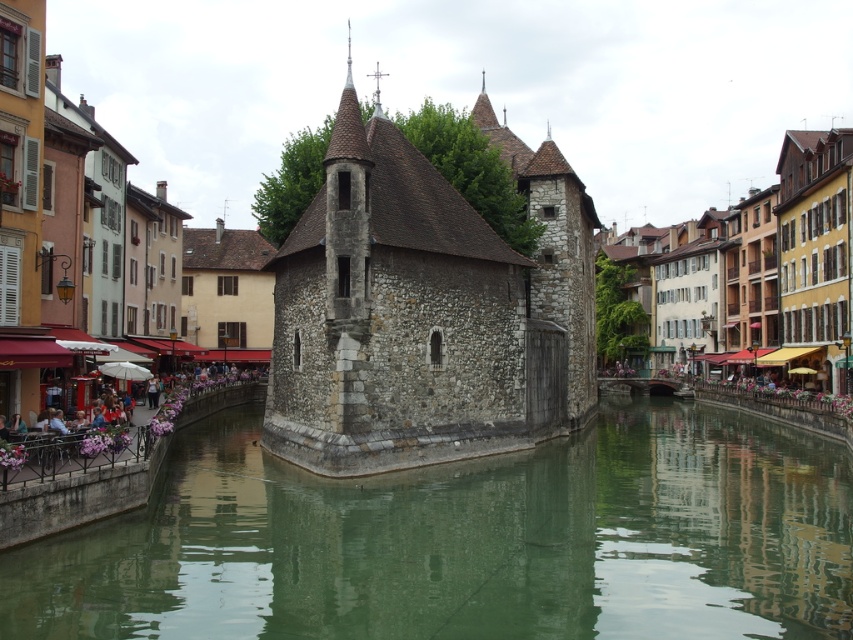
Who is shorter, stone building at center or stone/cobblestone castle at center?

stone/cobblestone castle at center is shorter.

What do you see at coordinates (467, 84) in the screenshot? I see `stone building at center` at bounding box center [467, 84].

I want to click on stone building at center, so click(467, 84).

Which is more to the left, green stone water at center or stone/cobblestone castle at center?

stone/cobblestone castle at center

Is green stone water at center thinner than stone/cobblestone castle at center?

In fact, green stone water at center might be wider than stone/cobblestone castle at center.

This screenshot has height=640, width=853. I want to click on green stone water at center, so click(467, 540).

Where is `green stone water at center`? This screenshot has width=853, height=640. green stone water at center is located at coordinates (467, 540).

Which is in front, point (515, 500) or point (376, 234)?

Point (515, 500) is in front.

Between green stone water at center and stone building at center, which one is positioned higher?

Positioned higher is stone building at center.

Locate an element on the screen. The image size is (853, 640). green stone water at center is located at coordinates (467, 540).

Locate an element on the screen. green stone water at center is located at coordinates (467, 540).